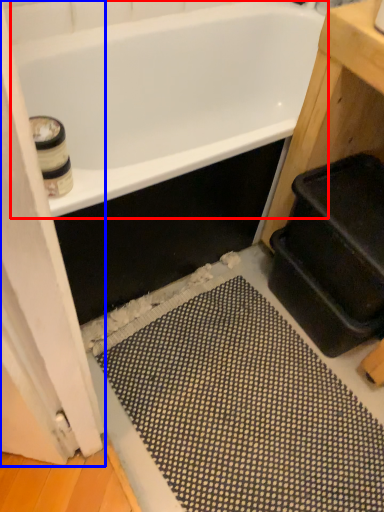
Question: Which of the following is the farthest to the observer, bathtub (highlighted by a red box) or screen door (highlighted by a blue box)?

Choices:
 (A) bathtub
 (B) screen door

Answer: (A)